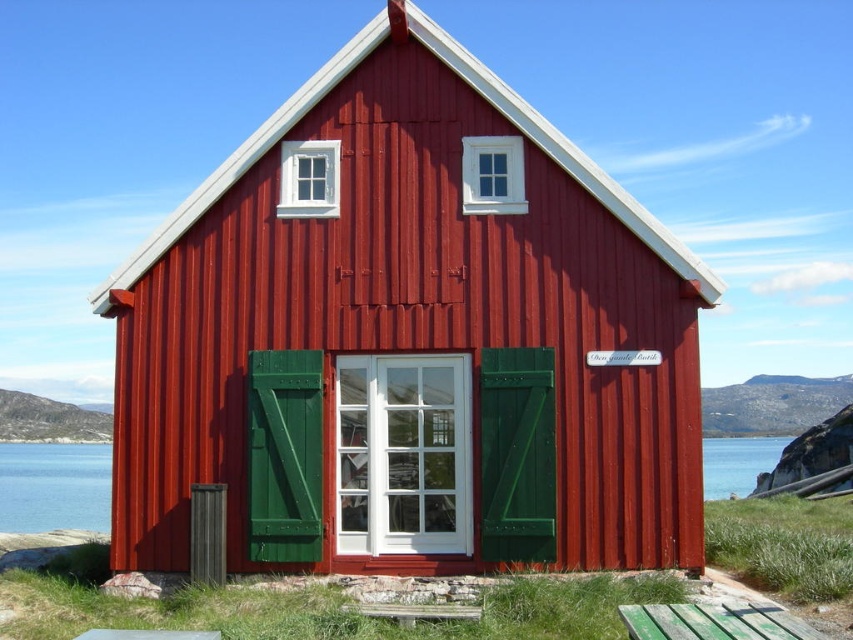
From the picture: You are a visitor approaching the red wooden house from the water side. You see the transparent glass water at lower center and the green weathered wood picnic table at lower right. Which object is closer to you as you approach the house?

The transparent glass water at lower center is closer to you because the green weathered wood picnic table at lower right is behind it.

You are standing at a point 9.25 meters away from the camera, which is the location of point [370,301]. You want to take a photo of the traditional red wooden house with the small sign on the door visible. Is your current position suitable for capturing the entire house in the frame?

The distance of point [370,301] from camera is 9.25 meters. Since you are at that point, you are 9.25 meters away from the camera position. Whether this distance allows the entire house to be in frame depends on your camera lens and sensor size, which are not specified here. The question cannot be answered with the given information.

You are standing in front of the red wooden house and want to place a tall plant pot that is 1.2 meters in height. Which object between the transparent glass water at lower center and the green weathered wood picnic table at lower right can accommodate the plant pot without it being too tall?

The transparent glass water at lower center has a greater height compared to the green weathered wood picnic table at lower right. Since the plant pot is 1.2 meters tall, it can be placed on the transparent glass water at lower center as it can accommodate the height.